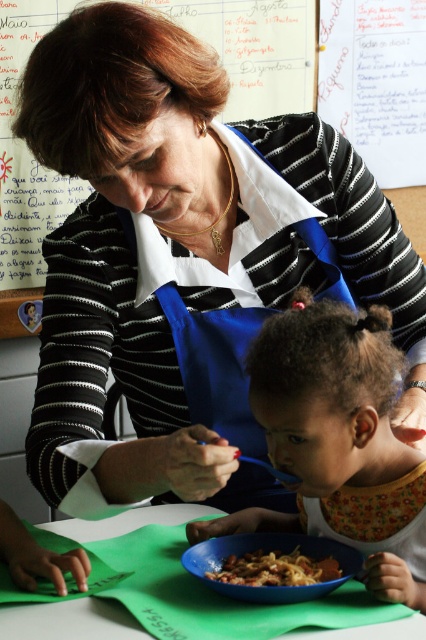
You are a photographer taking a picture of the scene. You want to focus on the point closer to the camera between point (210,17) and point (403,636). Which point should you focus on?

Point (210,17) is further to the camera than point (403,636), so you should focus on point (210,17).

You need to place a small toy on the table so that it doesn t interfere with the meal. Where should you put it, on the green paper at lower center or the matte plastic bowl at center?

The green paper at lower center is larger in size than the matte plastic bowl at center, so you should place the small toy on the green paper at lower center to avoid interfering with the meal.